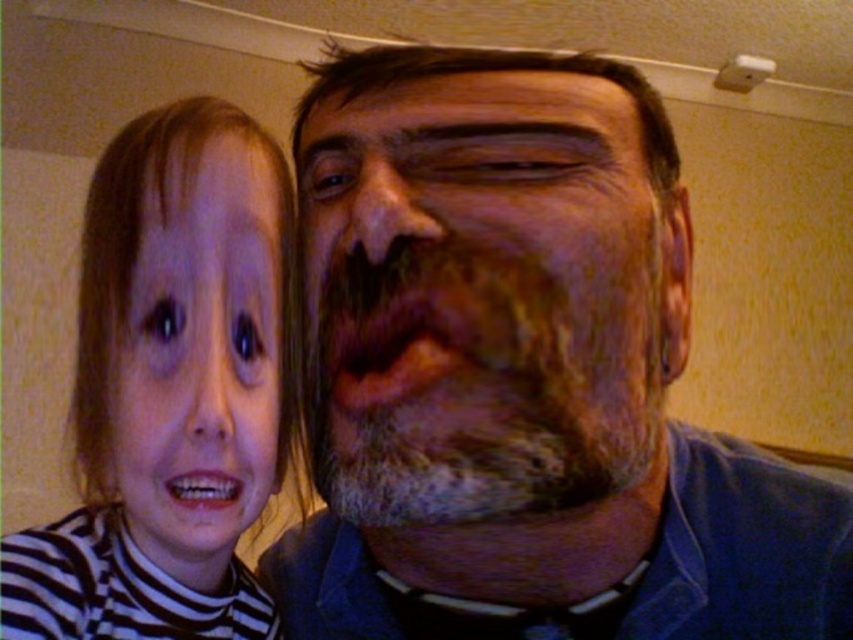
At what (x,y) coordinates should I click in order to perform the action: click on gray beard at left. Please return your answer as a coordinate pair (x, y). This screenshot has height=640, width=853. Looking at the image, I should click on (521, 374).

Is gray beard at left to the right of striped turtleneck at left from the viewer's perspective?

Correct, you'll find gray beard at left to the right of striped turtleneck at left.

Where is `gray beard at left`? gray beard at left is located at coordinates (521, 374).

Who is positioned more to the right, striped turtleneck at left or smooth skin face at left?

Positioned to the right is smooth skin face at left.

Between point (10, 570) and point (181, 332), which one is positioned in front?

Positioned in front is point (181, 332).

The image size is (853, 640). I want to click on striped turtleneck at left, so pyautogui.click(x=171, y=388).

Between point (386, 96) and point (187, 364), which one is positioned in front?

Point (187, 364)

Where is `grayish-brown beard at center`? This screenshot has height=640, width=853. grayish-brown beard at center is located at coordinates (480, 296).